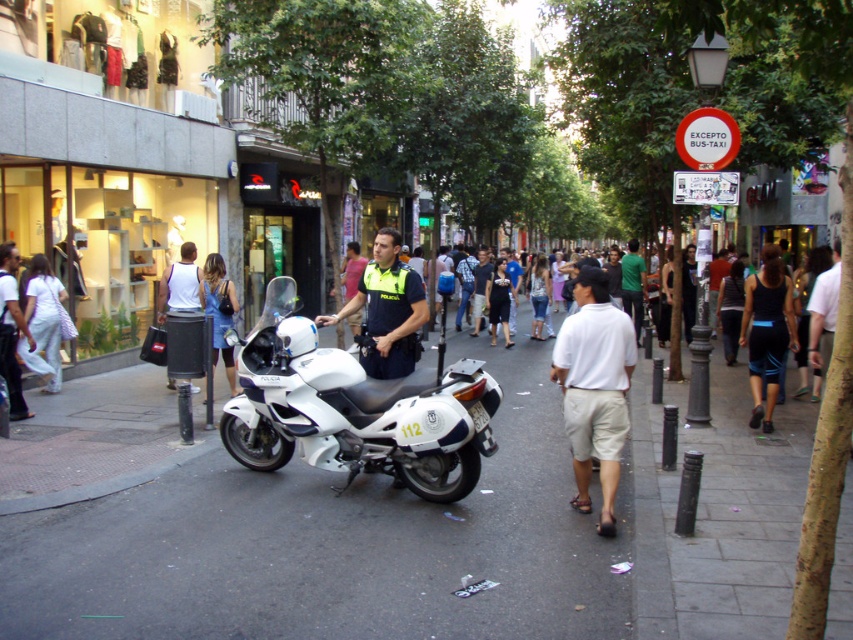
Question: Which point is farther to the camera?

Choices:
 (A) (409, 308)
 (B) (624, 388)
 (C) (325, 368)

Answer: (A)

Question: Does white cotton shirt at center appear on the left side of dark blue uniform at center?

Choices:
 (A) yes
 (B) no

Answer: (B)

Question: Considering the real-world distances, which object is closest to the white cotton shirt at center?

Choices:
 (A) white asphalt at center
 (B) black fabric tank top at right

Answer: (B)

Question: From the image, what is the correct spatial relationship of dark blue uniform at center in relation to black fabric tank top at right?

Choices:
 (A) right
 (B) left

Answer: (B)

Question: Can you confirm if denim skirt at center is positioned above white matte tank top at center?

Choices:
 (A) yes
 (B) no

Answer: (B)

Question: Considering the real-world distances, which object is farthest from the white matte tank top at center?

Choices:
 (A) dark blue uniform at center
 (B) white cotton shirt at center
 (C) green shirt at center
 (D) black fabric tank top at right

Answer: (C)